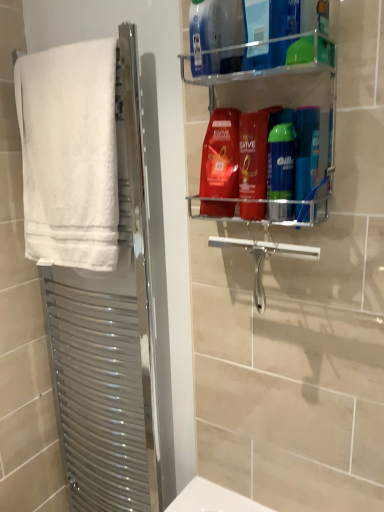
What is the approximate height of blue glossy shampoo at upper right, marked as the 2th toiletry in a left-to-right arrangement?

The height of blue glossy shampoo at upper right, marked as the 2th toiletry in a left-to-right arrangement, is 8.58 inches.

What are the coordinates of `white fluffy towel at left` in the screenshot? It's located at (69, 154).

This screenshot has width=384, height=512. What do you see at coordinates (69, 154) in the screenshot?
I see `white fluffy towel at left` at bounding box center [69, 154].

What is the approximate width of clear plastic shelf at upper right?

4.82 inches.

Image resolution: width=384 pixels, height=512 pixels. I want to click on shiny red shampoo at center, the second cleaning product when ordered from bottom to top, so click(221, 155).

The width and height of the screenshot is (384, 512). In order to click on silver metallic towel rack at left in this screenshot , I will do 109,337.

Can you confirm if shiny red shampoo at upper center, positioned as the 1th cleaning product in bottom-to-top order, is thinner than silver metallic towel rack at left?

Yes, shiny red shampoo at upper center, positioned as the 1th cleaning product in bottom-to-top order, is thinner than silver metallic towel rack at left.

Which is more to the right, shiny red shampoo at upper center, positioned as the 1th cleaning product in bottom-to-top order, or silver metallic towel rack at left?

shiny red shampoo at upper center, positioned as the 1th cleaning product in bottom-to-top order.

Does shiny red shampoo at upper center, positioned as the 1th cleaning product in bottom-to-top order, have a greater height compared to silver metallic towel rack at left?

In fact, shiny red shampoo at upper center, positioned as the 1th cleaning product in bottom-to-top order, may be shorter than silver metallic towel rack at left.

Who is taller, shiny red shampoo at center, the second cleaning product when ordered from top to bottom, or green glossy shaving cream can at center right, the second toiletry positioned from the right?

Standing taller between the two is shiny red shampoo at center, the second cleaning product when ordered from top to bottom.

How many degrees apart are the facing directions of shiny red shampoo at center, the second cleaning product when ordered from bottom to top, and green glossy shaving cream can at center right, which ranks as the 1th toiletry in left-to-right order?

They differ by 0.00128 degrees in their facing directions.

Which is in front, point (227, 129) or point (275, 155)?

The point (275, 155) is more forward.

Considering the relative sizes of shiny red shampoo at center, the second cleaning product when ordered from top to bottom, and green glossy shaving cream can at center right, the second toiletry positioned from the right, in the image provided, is shiny red shampoo at center, the second cleaning product when ordered from top to bottom, thinner than green glossy shaving cream can at center right, the second toiletry positioned from the right,?

Incorrect, the width of shiny red shampoo at center, the second cleaning product when ordered from top to bottom, is not less than that of green glossy shaving cream can at center right, the second toiletry positioned from the right.

Considering the relative positions of silver metallic towel rack at left and white fluffy towel at left in the image provided, is silver metallic towel rack at left to the right of white fluffy towel at left from the viewer's perspective?

Yes, silver metallic towel rack at left is to the right of white fluffy towel at left.

In order to click on screen door below the white fluffy towel at left (from a real-world perspective) in this screenshot , I will do `click(109, 337)`.

Based on the photo, from the image's perspective, is silver metallic towel rack at left under white fluffy towel at left?

Correct, silver metallic towel rack at left appears lower than white fluffy towel at left in the image.

Is silver metallic towel rack at left outside of white fluffy towel at left?

Yes, silver metallic towel rack at left is not within white fluffy towel at left.

Can you tell me how much white fluffy towel at left and clear plastic shelf at upper right differ in facing direction?

The facing directions of white fluffy towel at left and clear plastic shelf at upper right are 0.562 degrees apart.

Can you confirm if white fluffy towel at left is taller than clear plastic shelf at upper right?

Indeed, white fluffy towel at left has a greater height compared to clear plastic shelf at upper right.

Does point (50, 114) come behind point (197, 82)?

Yes, it is.

Is white fluffy towel at left not near clear plastic shelf at upper right?

No, white fluffy towel at left is in close proximity to clear plastic shelf at upper right.

Is clear plastic shelf at upper right looking in the opposite direction of shiny red shampoo at center, the second cleaning product when ordered from bottom to top?

Yes, clear plastic shelf at upper right is facing away from shiny red shampoo at center, the second cleaning product when ordered from bottom to top.

From a real-world perspective, who is located higher, clear plastic shelf at upper right or shiny red shampoo at center, the second cleaning product when ordered from top to bottom?

From a 3D spatial view, clear plastic shelf at upper right is above.

Does point (274, 80) come behind point (229, 188)?

No, it is not.

Considering the relative sizes of clear plastic shelf at upper right and shiny red shampoo at center, the second cleaning product when ordered from bottom to top, in the image provided, is clear plastic shelf at upper right bigger than shiny red shampoo at center, the second cleaning product when ordered from bottom to top,?

Indeed, clear plastic shelf at upper right has a larger size compared to shiny red shampoo at center, the second cleaning product when ordered from bottom to top.

Based on the photo, from the image's perspective, is white fluffy towel at left located above blue plastic bottle at upper center, which is the third cleaning product in bottom-to-top order?

No, from the image's perspective, white fluffy towel at left is not over blue plastic bottle at upper center, which is the third cleaning product in bottom-to-top order.

Can you confirm if white fluffy towel at left is taller than blue plastic bottle at upper center, which is the third cleaning product in bottom-to-top order?

Correct, white fluffy towel at left is much taller as blue plastic bottle at upper center, which is the third cleaning product in bottom-to-top order.

Is point (72, 55) closer or farther from the camera than point (288, 45)?

Point (72, 55) appears to be farther away from the viewer than point (288, 45).

Can you confirm if white fluffy towel at left is wider than blue plastic bottle at upper center, which is the third cleaning product in bottom-to-top order?

Indeed, white fluffy towel at left has a greater width compared to blue plastic bottle at upper center, which is the third cleaning product in bottom-to-top order.

How different are the orientations of blue glossy shampoo at upper right, marked as the 2th toiletry in a left-to-right arrangement, and shiny red shampoo at center, the second cleaning product when ordered from bottom to top, in degrees?

The angular difference between blue glossy shampoo at upper right, marked as the 2th toiletry in a left-to-right arrangement, and shiny red shampoo at center, the second cleaning product when ordered from bottom to top, is 0.000204 degrees.

Does blue glossy shampoo at upper right, marked as the 2th toiletry in a left-to-right arrangement, have a lesser width compared to shiny red shampoo at center, the second cleaning product when ordered from top to bottom?

Yes, blue glossy shampoo at upper right, marked as the 2th toiletry in a left-to-right arrangement, is thinner than shiny red shampoo at center, the second cleaning product when ordered from top to bottom.

In terms of height, does blue glossy shampoo at upper right, which is counted as the 1th toiletry, starting from the right, look taller or shorter compared to shiny red shampoo at center, the second cleaning product when ordered from bottom to top?

Considering their sizes, blue glossy shampoo at upper right, which is counted as the 1th toiletry, starting from the right, has less height than shiny red shampoo at center, the second cleaning product when ordered from bottom to top.

From a real-world perspective, count 1st cleaning products upward from the silver metallic towel rack at left and point to it. Please provide its 2D coordinates.

[(254, 153)]

Identify the location of the 1st toiletry to the right of the shiny red shampoo at center, the second cleaning product when ordered from bottom to top, counting from the anchor's position. The width and height of the screenshot is (384, 512). (281, 162).

From the image, which object appears to be nearer to shiny red shampoo at upper center, which ranks as the third cleaning product in top-to-bottom order, blue glossy shampoo at upper right, marked as the 2th toiletry in a left-to-right arrangement, or silver metallic towel rack at left?

blue glossy shampoo at upper right, marked as the 2th toiletry in a left-to-right arrangement.

Estimate the real-world distances between objects in this image. Which object is further from green glossy shaving cream can at center right, which ranks as the 1th toiletry in left-to-right order, blue glossy shampoo at upper right, which is counted as the 1th toiletry, starting from the right, or clear plastic shelf at upper right?

Among the two, clear plastic shelf at upper right is located further to green glossy shaving cream can at center right, which ranks as the 1th toiletry in left-to-right order.

Considering their positions, is blue glossy shampoo at upper right, which is counted as the 1th toiletry, starting from the right, positioned further to white fluffy towel at left than shiny red shampoo at center, the second cleaning product when ordered from top to bottom?

The object further to white fluffy towel at left is blue glossy shampoo at upper right, which is counted as the 1th toiletry, starting from the right.

Considering their positions, is blue plastic bottle at upper center, which is the third cleaning product in bottom-to-top order, positioned closer to silver metallic towel rack at left than shiny red shampoo at upper center, positioned as the 1th cleaning product in bottom-to-top order?

shiny red shampoo at upper center, positioned as the 1th cleaning product in bottom-to-top order, lies closer to silver metallic towel rack at left than the other object.

Considering their positions, is silver metallic towel rack at left positioned closer to shiny red shampoo at center, the second cleaning product when ordered from top to bottom, than green glossy shaving cream can at center right, the second toiletry positioned from the right?

green glossy shaving cream can at center right, the second toiletry positioned from the right.

Consider the image. When comparing their distances from green glossy shaving cream can at center right, the second toiletry positioned from the right, does silver metallic towel rack at left or white fluffy towel at left seem closer?

white fluffy towel at left is positioned closer to the anchor green glossy shaving cream can at center right, the second toiletry positioned from the right.

Estimate the real-world distances between objects in this image. Which object is closer to shiny red shampoo at upper center, positioned as the 1th cleaning product in bottom-to-top order, blue plastic bottle at upper center, which ranks as the first cleaning product in top-to-bottom order, or white fluffy towel at left?

Among the two, blue plastic bottle at upper center, which ranks as the first cleaning product in top-to-bottom order, is located nearer to shiny red shampoo at upper center, positioned as the 1th cleaning product in bottom-to-top order.

Considering their positions, is green glossy shaving cream can at center right, which ranks as the 1th toiletry in left-to-right order, positioned further to white fluffy towel at left than shiny red shampoo at upper center, which ranks as the third cleaning product in top-to-bottom order?

Based on the image, green glossy shaving cream can at center right, which ranks as the 1th toiletry in left-to-right order, appears to be further to white fluffy towel at left.

You are a GUI agent. You are given a task and a screenshot of the screen. Output one action in this format:
    pyautogui.click(x=<x>, y=<y>)
    Task: Click on the shelf between blue plastic bottle at upper center, which ranks as the first cleaning product in top-to-bottom order, and green glossy shaving cream can at center right, which ranks as the 1th toiletry in left-to-right order, in the up-down direction
    
    Given the screenshot: What is the action you would take?
    pyautogui.click(x=281, y=99)

Locate an element on the screen. shelf situated between white fluffy towel at left and blue glossy shampoo at upper right, marked as the 2th toiletry in a left-to-right arrangement, from left to right is located at coordinates (281, 99).

Locate an element on the screen. cleaning product that lies between shiny red shampoo at center, the second cleaning product when ordered from top to bottom, and silver metallic towel rack at left from top to bottom is located at coordinates (254, 153).

I want to click on shelf between white fluffy towel at left and green glossy shaving cream can at center right, the second toiletry positioned from the right, in the horizontal direction, so click(281, 99).